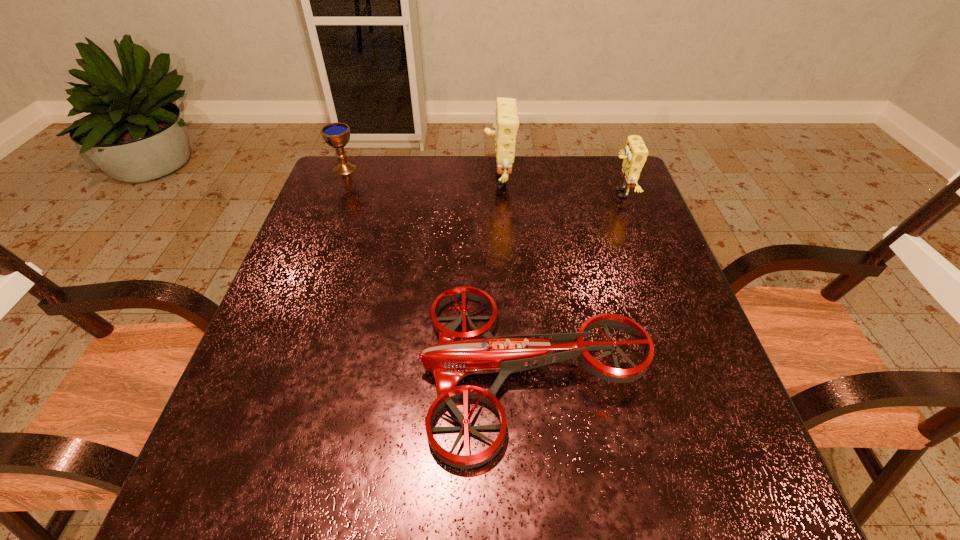
The width and height of the screenshot is (960, 540). Find the location of `free space between the tallest object and the second shortest object`. free space between the tallest object and the second shortest object is located at coordinates (421, 173).

The height and width of the screenshot is (540, 960). I want to click on vacant region between the rightmost object and the shortest object, so tap(576, 281).

Find the location of `vacant area that lies between the chalice and the nearest object`. vacant area that lies between the chalice and the nearest object is located at coordinates tap(439, 269).

Where is `free space between the left sponge and the leftmost object`? Image resolution: width=960 pixels, height=540 pixels. free space between the left sponge and the leftmost object is located at coordinates (421, 173).

Locate an element on the screen. The height and width of the screenshot is (540, 960). free space between the right sponge and the drone is located at coordinates (576, 281).

The image size is (960, 540). Identify the location of unoccupied area between the third shortest object and the second shortest object. (483, 181).

At what (x,y) coordinates should I click in order to perform the action: click on vacant space that's between the taller sponge and the rightmost object. Please return your answer as a coordinate pair (x, y). The width and height of the screenshot is (960, 540). Looking at the image, I should click on (560, 186).

Find the location of a particular element. Image resolution: width=960 pixels, height=540 pixels. free space between the rightmost object and the taller sponge is located at coordinates (560, 186).

Find the location of a particular element. object identified as the third closest to the nearest object is located at coordinates (337, 135).

Locate an element on the screen. the closest object relative to the third tallest object is located at coordinates (506, 124).